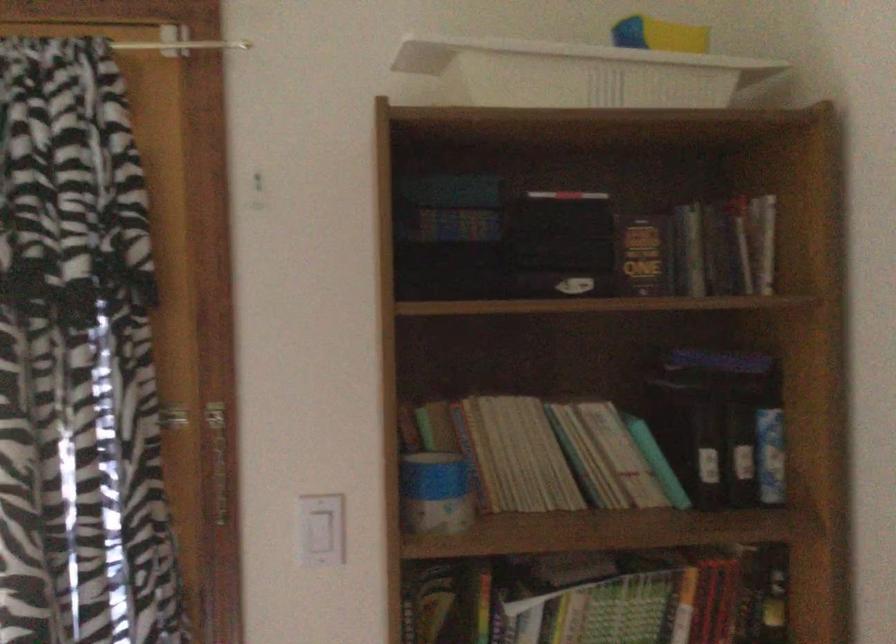
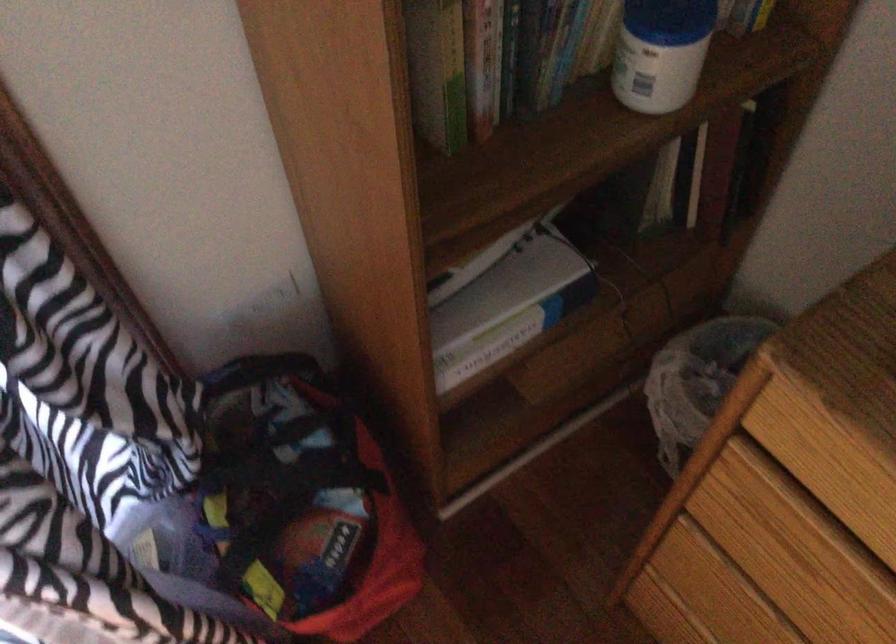
The images are taken continuously from a first-person perspective. In which direction is your viewpoint rotating?

The rotation direction of the camera is right-down.